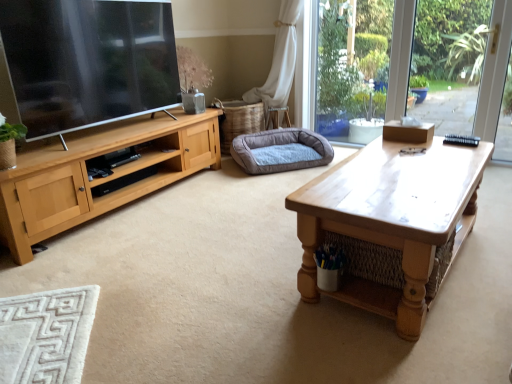
Question: Can you confirm if gray fabric dog bed at center is shorter than wooden coffee table at center?

Choices:
 (A) no
 (B) yes

Answer: (B)

Question: Is the position of gray fabric dog bed at center less distant than that of wooden coffee table at center?

Choices:
 (A) yes
 (B) no

Answer: (B)

Question: From the image's perspective, is gray fabric dog bed at center beneath wooden coffee table at center?

Choices:
 (A) no
 (B) yes

Answer: (A)

Question: Is gray fabric dog bed at center not inside wooden coffee table at center?

Choices:
 (A) no
 (B) yes

Answer: (B)

Question: Is gray fabric dog bed at center thinner than wooden coffee table at center?

Choices:
 (A) yes
 (B) no

Answer: (A)

Question: Does gray fabric dog bed at center have a greater width compared to wooden coffee table at center?

Choices:
 (A) no
 (B) yes

Answer: (A)

Question: Considering the relative positions of wooden coffee table at center and gray fabric dog bed at center in the image provided, is wooden coffee table at center behind gray fabric dog bed at center?

Choices:
 (A) no
 (B) yes

Answer: (A)

Question: Is gray fabric dog bed at center at the back of wooden coffee table at center?

Choices:
 (A) no
 (B) yes

Answer: (A)

Question: Is wooden coffee table at center shorter than gray fabric dog bed at center?

Choices:
 (A) yes
 (B) no

Answer: (B)

Question: Does wooden coffee table at center have a lesser width compared to gray fabric dog bed at center?

Choices:
 (A) no
 (B) yes

Answer: (A)

Question: Does wooden coffee table at center contain gray fabric dog bed at center?

Choices:
 (A) no
 (B) yes

Answer: (A)

Question: From the image's perspective, is wooden coffee table at center above gray fabric dog bed at center?

Choices:
 (A) yes
 (B) no

Answer: (B)

Question: From a real-world perspective, relative to wooden coffee table at center, is gray fabric dog bed at center vertically above or below?

Choices:
 (A) below
 (B) above

Answer: (A)